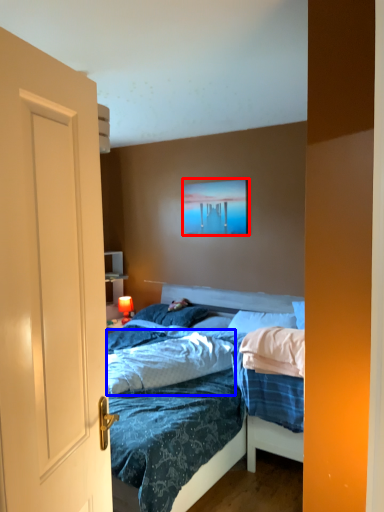
Question: Which object is further to the camera taking this photo, picture frame (highlighted by a red box) or sheet (highlighted by a blue box)?

Choices:
 (A) picture frame
 (B) sheet

Answer: (A)